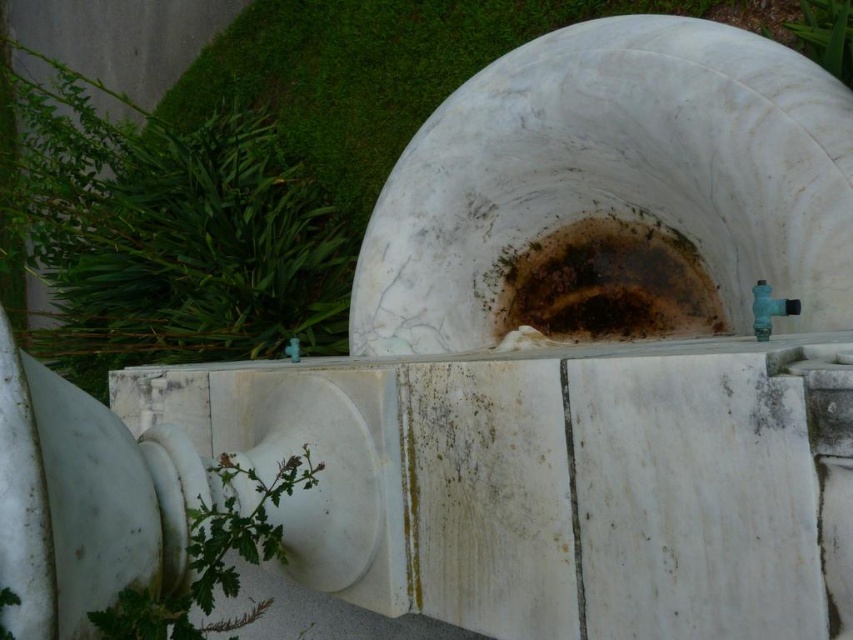
From the picture: Does green leafy plant at left have a lesser width compared to green grass at upper left?

Yes, green leafy plant at left is thinner than green grass at upper left.

Is green leafy plant at left to the right of green grass at upper left from the viewer's perspective?

In fact, green leafy plant at left is to the left of green grass at upper left.

This screenshot has width=853, height=640. What do you see at coordinates (173, 234) in the screenshot? I see `green leafy plant at left` at bounding box center [173, 234].

Where is `green leafy plant at left`? The height and width of the screenshot is (640, 853). green leafy plant at left is located at coordinates (173, 234).

Is green leafy plant at left in front of green leafy plant at lower left?

No, it is not.

Which is more to the right, green leafy plant at left or green leafy plant at lower left?

Positioned to the right is green leafy plant at lower left.

Between point (48, 192) and point (260, 532), which one is positioned in front?

Positioned in front is point (260, 532).

Identify the location of green leafy plant at left. coord(173,234).

Is green grass at upper left further to camera compared to green leafy plant at lower left?

Yes.

Can you confirm if green grass at upper left is positioned below green leafy plant at lower left?

Incorrect, green grass at upper left is not positioned below green leafy plant at lower left.

Describe the element at coordinates (413, 64) in the screenshot. I see `green grass at upper left` at that location.

This screenshot has height=640, width=853. What are the coordinates of `green grass at upper left` in the screenshot? It's located at (413, 64).